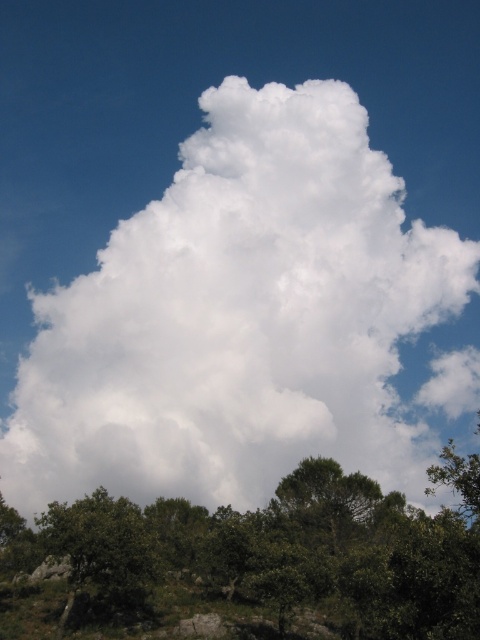
You are a bird flying at the height of the green leafy tree at lower left. Can you see the top of the white fluffy cloud at center from your current position?

The white fluffy cloud at center is much taller than the green leafy tree at lower left, so from the bird flying at the height of the green leafy tree at lower left, the top of the white fluffy cloud at center would not be visible.

Looking at this image, you are standing in a field looking up at the dramatic sky with the green leafy tree at lower center nearby. If you want to take a photo of the large cloud formation without the tree blocking the view, how far back should you move?

To avoid the green leafy tree at lower center blocking the view of the large cloud formation, you should move back to a distance greater than 18.61 meters from the tree.